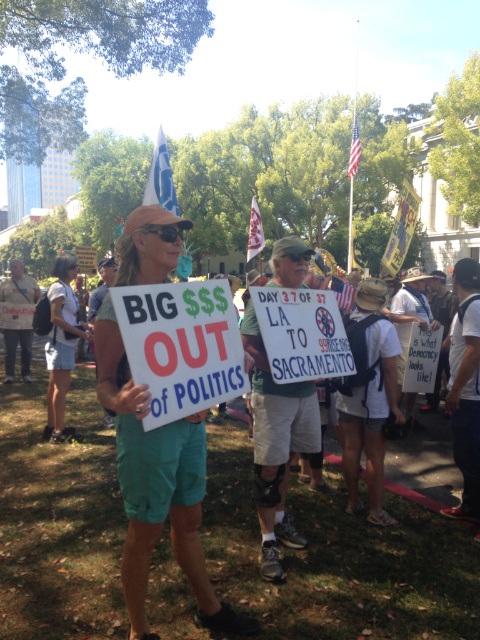
Question: Which of the following is the closest to the observer?

Choices:
 (A) pos(187,470)
 (B) pos(62,436)

Answer: (A)

Question: From the image, what is the correct spatial relationship of teal fabric shorts at center in relation to denim shorts at lower left?

Choices:
 (A) right
 (B) left

Answer: (A)

Question: Is teal fabric shorts at center positioned behind denim shorts at lower left?

Choices:
 (A) no
 (B) yes

Answer: (A)

Question: In this image, where is teal fabric shorts at center located relative to denim shorts at lower left?

Choices:
 (A) right
 (B) left

Answer: (A)

Question: Among these objects, which one is nearest to the camera?

Choices:
 (A) denim shorts at lower left
 (B) teal fabric shorts at center

Answer: (B)